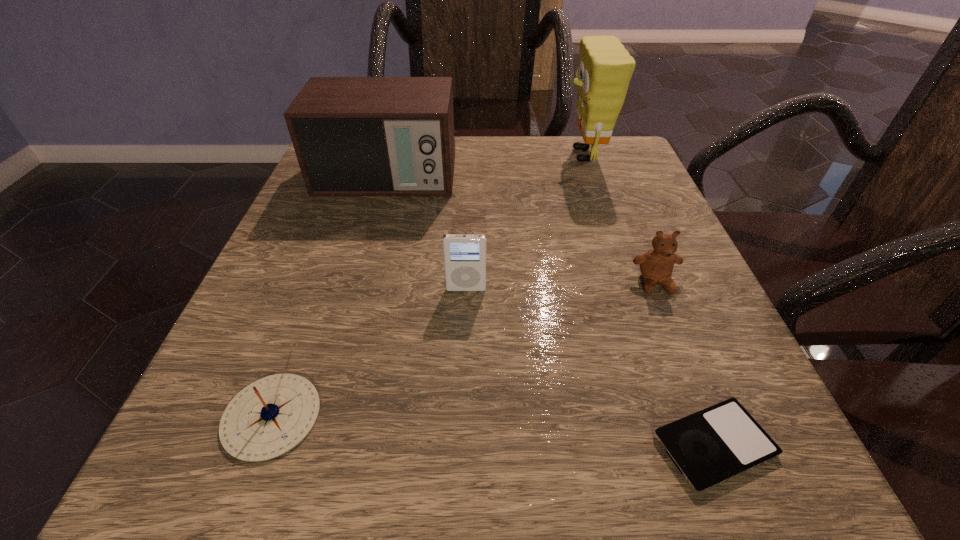
Where is `free space located on the face of the tallest object`? Image resolution: width=960 pixels, height=540 pixels. free space located on the face of the tallest object is located at coordinates (457, 155).

Find the location of a particular element. The width and height of the screenshot is (960, 540). vacant region located 0.190m on the front-facing side of the radio receiver is located at coordinates (360, 268).

Where is `blank space located 0.130m on the front-facing side of the third object from left to right`? This screenshot has width=960, height=540. blank space located 0.130m on the front-facing side of the third object from left to right is located at coordinates [464, 361].

Where is `vacant space located on the face of the teddy bear`? vacant space located on the face of the teddy bear is located at coordinates (711, 423).

Locate an element on the screen. vacant region located on the right of the second shortest object is located at coordinates (516, 416).

Find the location of a particular element. This screenshot has width=960, height=540. free space located 0.250m on the back of the shorter iPod is located at coordinates (644, 267).

Where is `sponge that is at the far edge`? The height and width of the screenshot is (540, 960). sponge that is at the far edge is located at coordinates (605, 68).

Where is `radio receiver present at the far edge`? The image size is (960, 540). radio receiver present at the far edge is located at coordinates (353, 136).

Where is `compass situated at the near edge`? compass situated at the near edge is located at coordinates (269, 417).

The width and height of the screenshot is (960, 540). I want to click on iPod at the near edge, so click(711, 446).